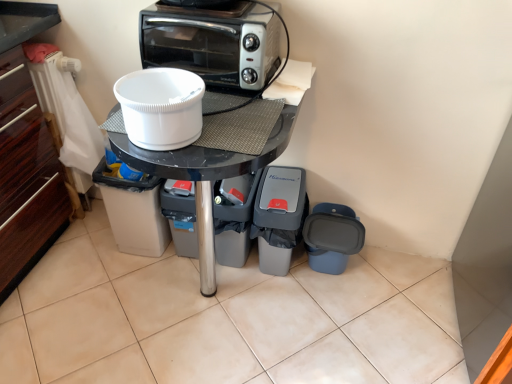
Find the location of a particular element. free space that is in between black glossy table at center and blue plastic trash can at lower right, the 1th appliance positioned from the right is located at coordinates (298, 312).